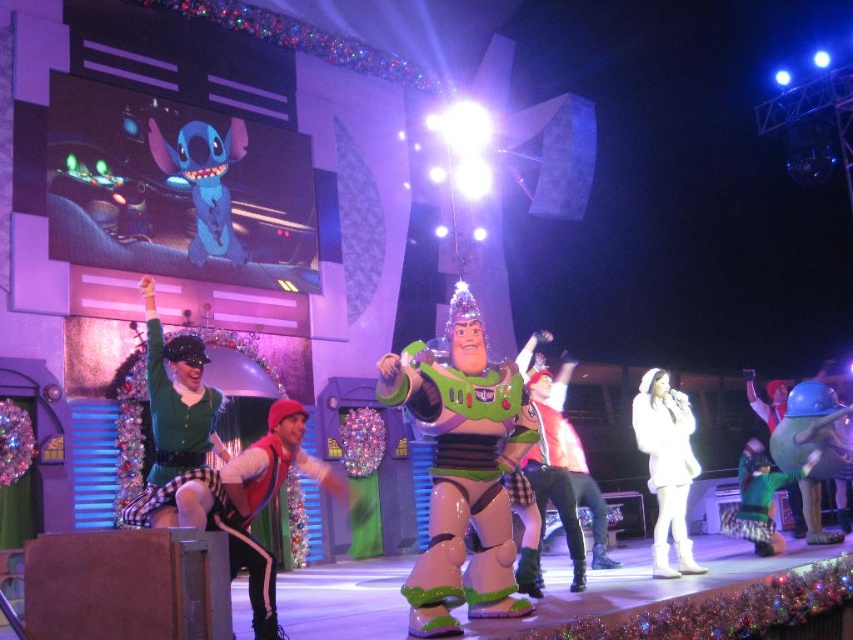
Question: Which point is closer to the camera taking this photo?

Choices:
 (A) (807, 474)
 (B) (451, 580)

Answer: (B)

Question: Which point appears farthest from the camera in this image?

Choices:
 (A) (671, 513)
 (B) (149, 301)
 (C) (167, 518)
 (D) (421, 566)

Answer: (A)

Question: Is green fabric costume at center to the right of green fuzzy sweater at center from the viewer's perspective?

Choices:
 (A) no
 (B) yes

Answer: (A)

Question: From the image, what is the correct spatial relationship of green velvet santa hat at upper left in relation to green fuzzy sweater at center?

Choices:
 (A) below
 (B) above

Answer: (B)

Question: Which of these objects is positioned closest to the white fur coat at center?

Choices:
 (A) green velvet santa hat at upper left
 (B) green fuzzy sweater at center
 (C) shiny plastic buzz lightyear at center

Answer: (B)

Question: Considering the relative positions of shiny plastic buzz lightyear at center and green fuzzy sweater at center in the image provided, where is shiny plastic buzz lightyear at center located with respect to green fuzzy sweater at center?

Choices:
 (A) below
 (B) above

Answer: (B)